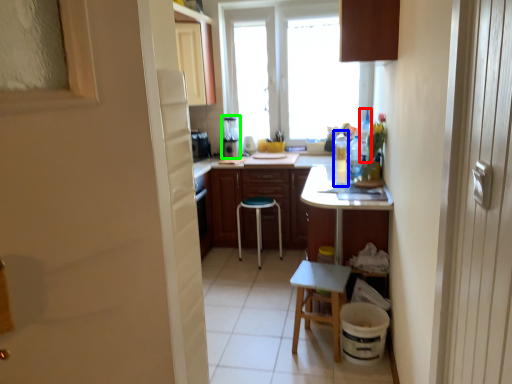
Question: Which object is positioned closest to bottle (highlighted by a red box)? Select from bottle (highlighted by a blue box) and appliance (highlighted by a green box).

Choices:
 (A) bottle
 (B) appliance

Answer: (A)